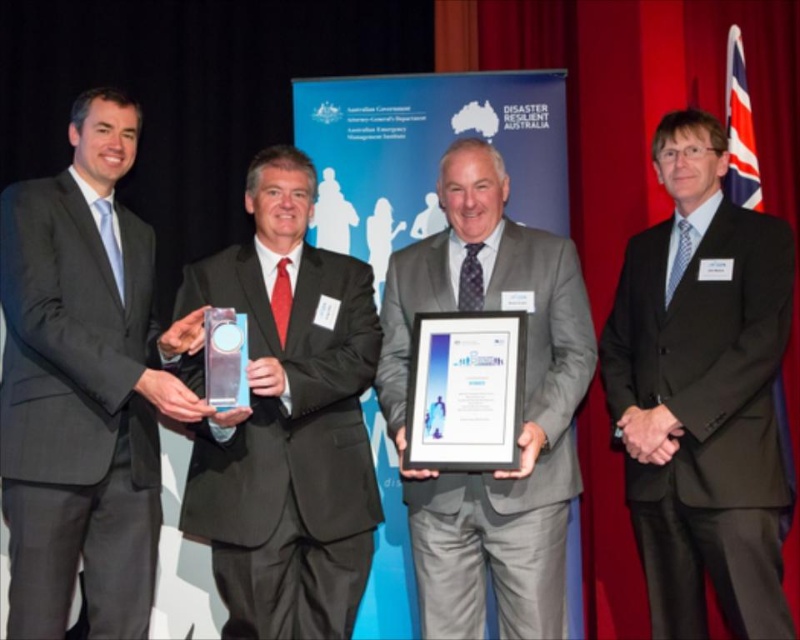
Question: Which point is farther to the camera?

Choices:
 (A) black suit at left
 (B) black suit at right
 (C) gray suit at center
 (D) matte black suit at center

Answer: (B)

Question: Among these points, which one is nearest to the camera?

Choices:
 (A) (76, 497)
 (B) (482, 308)
 (C) (306, 476)
 (D) (662, 525)

Answer: (A)

Question: In this image, where is black suit at left located relative to black suit at right?

Choices:
 (A) below
 (B) above

Answer: (B)

Question: Can you confirm if black suit at right is smaller than gray suit at center?

Choices:
 (A) no
 (B) yes

Answer: (B)

Question: Which of the following is the closest to the observer?

Choices:
 (A) black suit at left
 (B) matte black suit at center
 (C) black suit at right
 (D) gray suit at center

Answer: (A)

Question: Is black suit at right wider than gray suit at center?

Choices:
 (A) no
 (B) yes

Answer: (A)